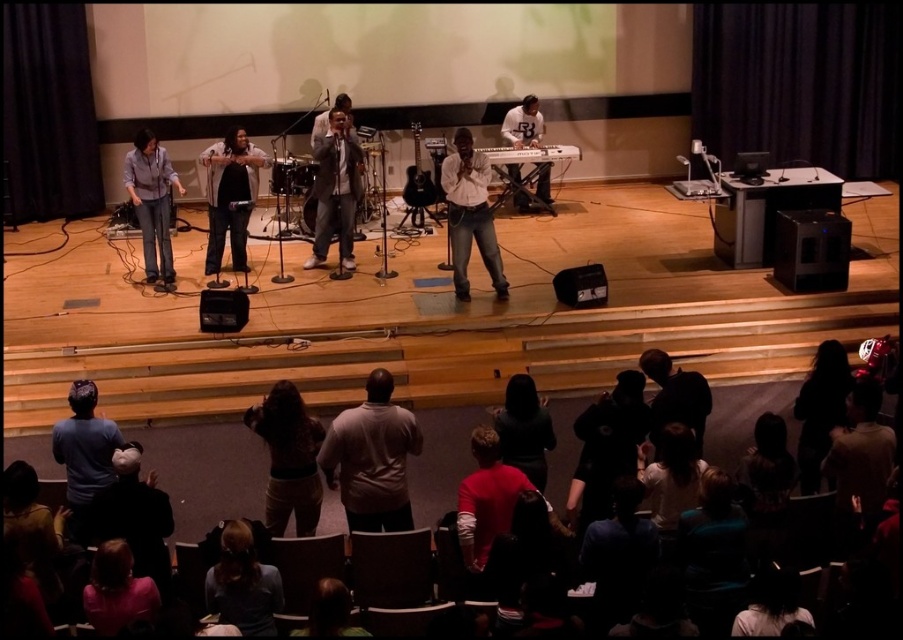
The width and height of the screenshot is (903, 640). I want to click on matte black microphones at center, so click(480, 205).

From the picture: Is matte black microphones at center positioned at the back of curly hair at center?

Yes, it is behind curly hair at center.

The height and width of the screenshot is (640, 903). Describe the element at coordinates (480, 205) in the screenshot. I see `matte black microphones at center` at that location.

In order to click on matte black microphones at center in this screenshot , I will do `click(480, 205)`.

Is matte black shirt at center to the right of pink fabric shirt at lower left from the viewer's perspective?

In fact, matte black shirt at center is to the left of pink fabric shirt at lower left.

Is matte black shirt at center positioned in front of pink fabric shirt at lower left?

No, matte black shirt at center is further to the viewer.

Describe the element at coordinates (230, 195) in the screenshot. I see `matte black shirt at center` at that location.

Locate an element on the screen. Image resolution: width=903 pixels, height=640 pixels. matte black shirt at center is located at coordinates (230, 195).

Does shiny silver microphone at center have a greater height compared to dark brown hair at lower right?

Indeed, shiny silver microphone at center has a greater height compared to dark brown hair at lower right.

Can you confirm if shiny silver microphone at center is smaller than dark brown hair at lower right?

Actually, shiny silver microphone at center might be larger than dark brown hair at lower right.

Does point (342, 141) lie in front of point (789, 465)?

No, it is not.

This screenshot has height=640, width=903. I want to click on shiny silver microphone at center, so click(x=334, y=189).